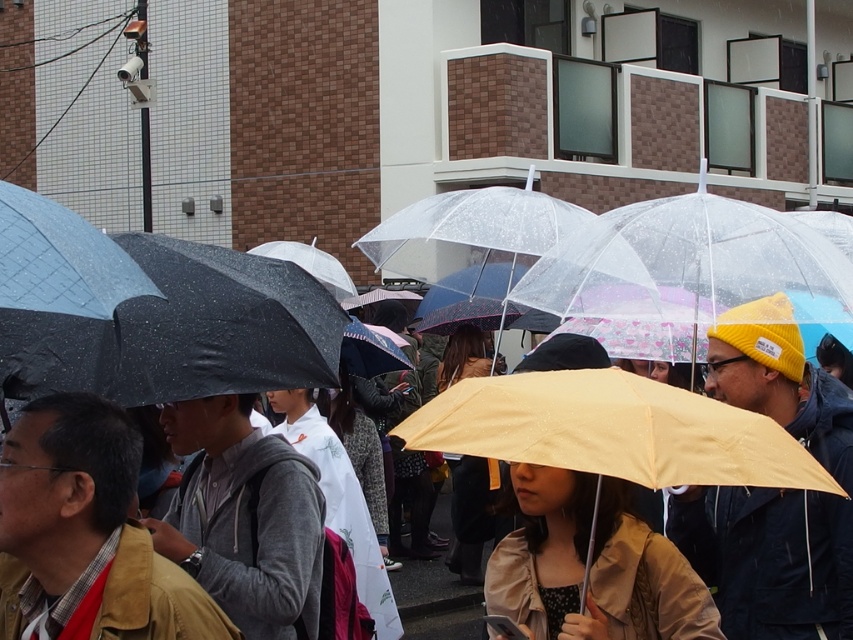
Which is more to the left, matte brown jacket at lower left or tan fabric jacket at center?

matte brown jacket at lower left

Which is below, matte brown jacket at lower left or tan fabric jacket at center?

tan fabric jacket at center is below.

Which is in front, point (155, 556) or point (511, 556)?

Point (155, 556) is in front.

Image resolution: width=853 pixels, height=640 pixels. In order to click on matte brown jacket at lower left in this screenshot , I will do `click(86, 532)`.

This screenshot has width=853, height=640. Describe the element at coordinates (242, 516) in the screenshot. I see `gray fleece jacket at center` at that location.

Can you confirm if gray fleece jacket at center is wider than tan fabric jacket at center?

No.

This screenshot has width=853, height=640. In order to click on gray fleece jacket at center in this screenshot , I will do `click(242, 516)`.

Can you confirm if matte brown jacket at lower left is wider than gray fleece jacket at center?

Yes, matte brown jacket at lower left is wider than gray fleece jacket at center.

This screenshot has width=853, height=640. What do you see at coordinates (86, 532) in the screenshot?
I see `matte brown jacket at lower left` at bounding box center [86, 532].

What are the coordinates of `matte brown jacket at lower left` in the screenshot? It's located at (86, 532).